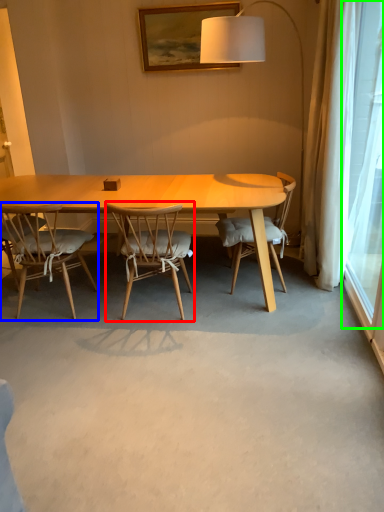
Question: Based on their relative distances, which object is nearer to chair (highlighted by a red box)? Choose from chair (highlighted by a blue box) and window screen (highlighted by a green box).

Choices:
 (A) chair
 (B) window screen

Answer: (A)